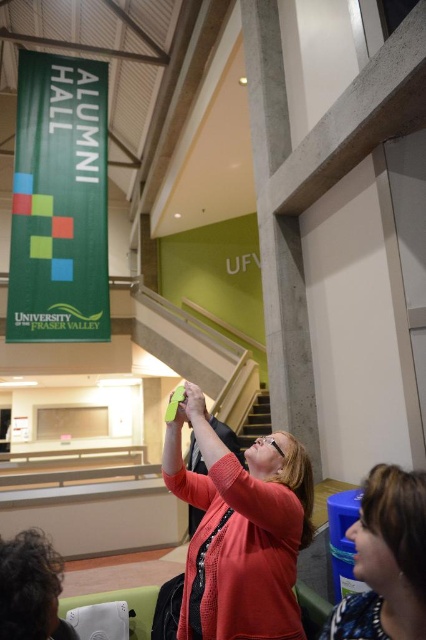
Does matte pink sweater at center come in front of blue plastic water cooler at lower right?

No, it is not.

Which is more to the right, matte pink sweater at center or blue plastic water cooler at lower right?

blue plastic water cooler at lower right

Is point (271, 508) closer to viewer compared to point (371, 522)?

No, (271, 508) is behind (371, 522).

Find the location of `matte pink sweater at center`. matte pink sweater at center is located at coordinates (241, 531).